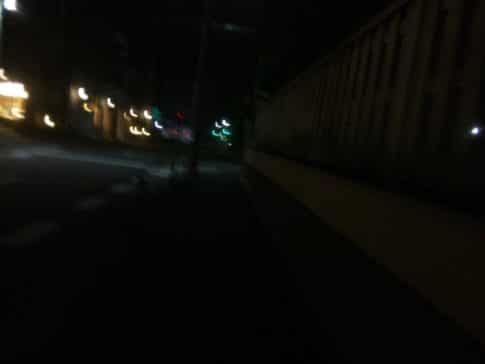
Image resolution: width=485 pixels, height=364 pixels. In order to click on light in this screenshot , I will do `click(86, 99)`, `click(109, 102)`, `click(132, 109)`, `click(142, 114)`, `click(156, 122)`, `click(134, 132)`, `click(225, 121)`, `click(50, 121)`, `click(8, 89)`, `click(11, 8)`.